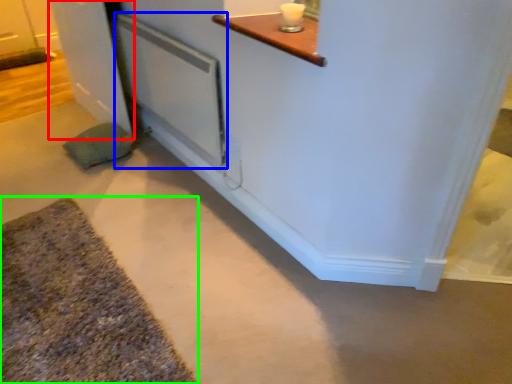
Question: Considering the real-world distances, which object is farthest from door (highlighted by a red box)? screen door (highlighted by a blue box) or bath mat (highlighted by a green box)?

Choices:
 (A) screen door
 (B) bath mat

Answer: (B)